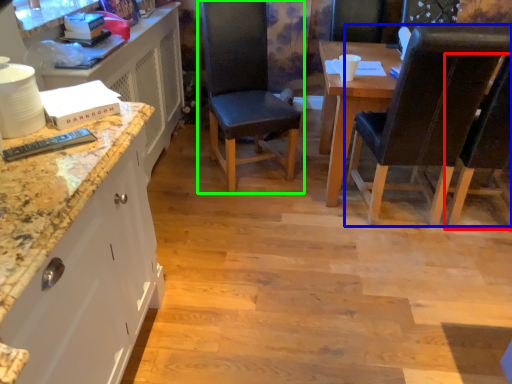
Question: Estimate the real-world distances between objects in this image. Which object is closer to chair (highlighted by a red box), chair (highlighted by a blue box) or chair (highlighted by a green box)?

Choices:
 (A) chair
 (B) chair

Answer: (A)